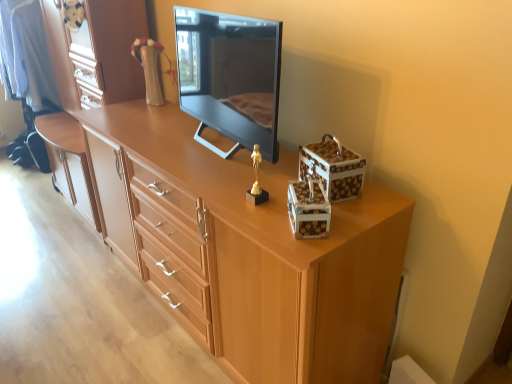
Describe the element at coordinates (97, 53) in the screenshot. I see `light brown wood dresser at center` at that location.

This screenshot has width=512, height=384. Describe the element at coordinates (333, 168) in the screenshot. I see `white glossy storage box at upper right, placed as the 1th storage box when sorted from back to front` at that location.

Looking at this image, measure the distance between gold metallic statue at center and camera.

The distance of gold metallic statue at center from camera is 4.12 feet.

This screenshot has height=384, width=512. What are the coordinates of `black glossy television at center` in the screenshot? It's located at (230, 77).

How different are the orientations of white glossy storage box at upper right, placed as the 1th storage box when sorted from back to front, and light wood chest of drawers at center in degrees?

The angular difference between white glossy storage box at upper right, placed as the 1th storage box when sorted from back to front, and light wood chest of drawers at center is 16.9 degrees.

Which is less distant, (334,139) or (239,178)?

The point (239,178) is more forward.

Is white glossy storage box at upper right, placed as the 1th storage box when sorted from back to front, in contact with light wood chest of drawers at center?

No, white glossy storage box at upper right, placed as the 1th storage box when sorted from back to front, is not next to light wood chest of drawers at center.

Considering the sizes of objects white glossy storage box at upper right, which is the 2th storage box in front-to-back order, and light wood chest of drawers at center in the image provided, who is shorter, white glossy storage box at upper right, which is the 2th storage box in front-to-back order, or light wood chest of drawers at center?

With less height is white glossy storage box at upper right, which is the 2th storage box in front-to-back order.

Between light wood chest of drawers at center and black glossy television at center, which one is positioned behind?

black glossy television at center is further away from the camera.

Is light wood chest of drawers at center surrounding black glossy television at center?

No, black glossy television at center is not inside light wood chest of drawers at center.

Is point (246, 264) positioned before point (267, 63)?

That is True.

Measure the distance between light wood chest of drawers at center and black glossy television at center.

light wood chest of drawers at center is 14.36 inches away from black glossy television at center.

Which object is further away from the camera, white glossy storage box at upper right, marked as the second storage box in a back-to-front arrangement, or black glossy television at center?

black glossy television at center.

Which object is positioned more to the right, white glossy storage box at upper right, marked as the second storage box in a back-to-front arrangement, or black glossy television at center?

A: Positioned to the right is white glossy storage box at upper right, marked as the second storage box in a back-to-front arrangement.

Is white glossy storage box at upper right, marked as the second storage box in a back-to-front arrangement, facing away from black glossy television at center?

No.

From their relative heights in the image, would you say white glossy storage box at upper right, the 1th storage box when ordered from front to back, is taller or shorter than black glossy television at center?

Considering their sizes, white glossy storage box at upper right, the 1th storage box when ordered from front to back, has less height than black glossy television at center.

What's the angular difference between white glossy storage box at upper right, placed as the 1th storage box when sorted from back to front, and light brown wood dresser at center's facing directions?

There is a 15.8-degree angle between the facing directions of white glossy storage box at upper right, placed as the 1th storage box when sorted from back to front, and light brown wood dresser at center.

Which is behind, point (306, 152) or point (104, 85)?

Point (104, 85)

Are white glossy storage box at upper right, which is the 2th storage box in front-to-back order, and light brown wood dresser at center far apart?

Indeed, white glossy storage box at upper right, which is the 2th storage box in front-to-back order, is not near light brown wood dresser at center.

Is white glossy storage box at upper right, which is the 2th storage box in front-to-back order, oriented towards light brown wood dresser at center?

No.

Which is in front, point (258, 152) or point (360, 160)?

The point (360, 160) is closer.

Who is bigger, gold metallic statue at center or white glossy storage box at upper right, placed as the 1th storage box when sorted from back to front?

Bigger between the two is white glossy storage box at upper right, placed as the 1th storage box when sorted from back to front.

Which object is thinner, gold metallic statue at center or white glossy storage box at upper right, placed as the 1th storage box when sorted from back to front?

gold metallic statue at center is thinner.

Is gold metallic statue at center positioned with its back to white glossy storage box at upper right, placed as the 1th storage box when sorted from back to front?

Yes, gold metallic statue at center's orientation is away from white glossy storage box at upper right, placed as the 1th storage box when sorted from back to front.

Identify the location of toy above the light wood chest of drawers at center (from a real-world perspective). (257, 180).

Considering the positions of objects gold metallic statue at center and light wood chest of drawers at center in the image provided, who is more to the right, gold metallic statue at center or light wood chest of drawers at center?

Positioned to the right is gold metallic statue at center.

Which of these two, gold metallic statue at center or light wood chest of drawers at center, is bigger?

light wood chest of drawers at center.

Which is correct: gold metallic statue at center is inside light wood chest of drawers at center, or outside of it?

gold metallic statue at center is located beyond the bounds of light wood chest of drawers at center.

Which is in front, point (184, 33) or point (255, 161)?

The point (255, 161) is more forward.

Considering the relative positions of black glossy television at center and gold metallic statue at center in the image provided, is black glossy television at center to the left of gold metallic statue at center from the viewer's perspective?

Yes.

Does black glossy television at center have a greater width compared to gold metallic statue at center?

Indeed, black glossy television at center has a greater width compared to gold metallic statue at center.

In order to click on storage box that is the 2nd object located behind the light wood chest of drawers at center in this screenshot , I will do `click(333, 168)`.

Find the location of a particular element. The width and height of the screenshot is (512, 384). chest of drawers on the left of black glossy television at center is located at coordinates (256, 255).

Which object lies further to the anchor point white glossy storage box at upper right, placed as the 1th storage box when sorted from back to front, black glossy television at center or light wood chest of drawers at center?

light wood chest of drawers at center is further to white glossy storage box at upper right, placed as the 1th storage box when sorted from back to front.

Looking at the image, which one is located further to white glossy storage box at upper right, which is the 2th storage box in front-to-back order, black glossy television at center or light brown wood dresser at center?

Based on the image, light brown wood dresser at center appears to be further to white glossy storage box at upper right, which is the 2th storage box in front-to-back order.

Based on the photo, from the image, which object appears to be farther from light wood chest of drawers at center, light brown wood dresser at center or black glossy television at center?

light brown wood dresser at center.

Considering their positions, is gold metallic statue at center positioned closer to light brown wood dresser at center than white glossy storage box at upper right, marked as the second storage box in a back-to-front arrangement?

Among the two, gold metallic statue at center is located nearer to light brown wood dresser at center.

From the image, which object appears to be farther from light brown wood dresser at center, light wood chest of drawers at center or gold metallic statue at center?

gold metallic statue at center.

From the image, which object appears to be nearer to light brown wood dresser at center, light wood chest of drawers at center or black glossy television at center?

black glossy television at center is positioned closer to the anchor light brown wood dresser at center.

Based on their spatial positions, is white glossy storage box at upper right, which is the 2th storage box in front-to-back order, or light wood chest of drawers at center closer to gold metallic statue at center?

white glossy storage box at upper right, which is the 2th storage box in front-to-back order, is closer to gold metallic statue at center.

Considering their positions, is black glossy television at center positioned closer to light wood chest of drawers at center than light brown wood dresser at center?

The object closer to light wood chest of drawers at center is black glossy television at center.

Identify the location of storage box between black glossy television at center and gold metallic statue at center in the vertical direction. Image resolution: width=512 pixels, height=384 pixels. pos(333,168).

At what (x,y) coordinates should I click in order to perform the action: click on television between light brown wood dresser at center and white glossy storage box at upper right, placed as the 1th storage box when sorted from back to front, in the horizontal direction. Please return your answer as a coordinate pair (x, y). This screenshot has height=384, width=512. Looking at the image, I should click on (230, 77).

Where is `toy between light brown wood dresser at center and white glossy storage box at upper right, which is the 2th storage box in front-to-back order, from left to right`? The height and width of the screenshot is (384, 512). toy between light brown wood dresser at center and white glossy storage box at upper right, which is the 2th storage box in front-to-back order, from left to right is located at coordinates (257, 180).

In order to click on television situated between light brown wood dresser at center and white glossy storage box at upper right, marked as the second storage box in a back-to-front arrangement, from left to right in this screenshot , I will do `click(230, 77)`.